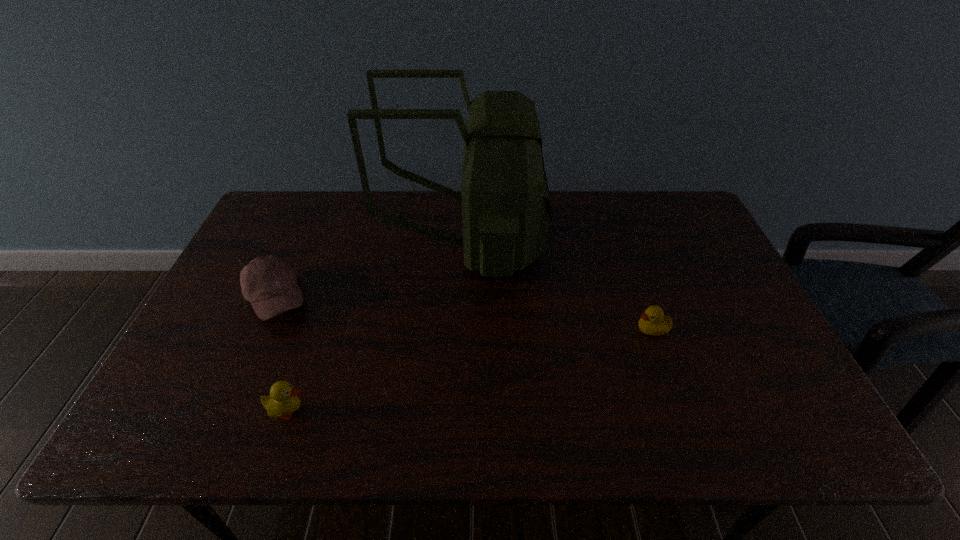
Find the location of a particular element. unoccupied position between the taller duckling and the rightmost object is located at coordinates (470, 370).

Where is `object that is the third closest to the tallest object`? The height and width of the screenshot is (540, 960). object that is the third closest to the tallest object is located at coordinates (283, 400).

In order to click on object that is the closest one to the farther duckling in this screenshot , I will do `click(506, 210)`.